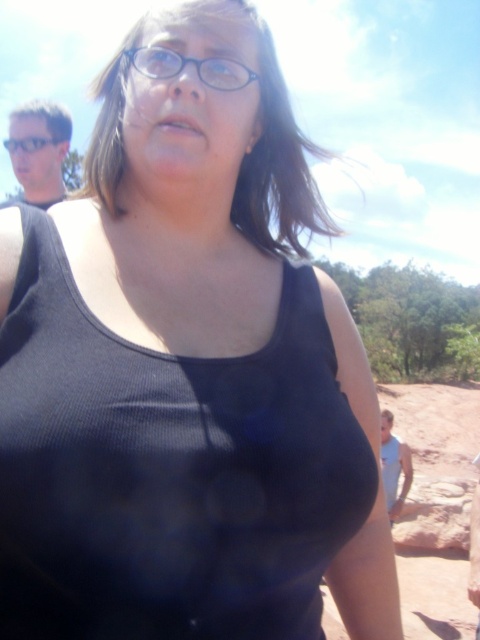
You are a photographer trying to capture the best shot of the two black plastic glasses at center and black plastic glasses at upper center. Which one is smaller in size?

The black plastic glasses at center occupies less space than the black plastic glasses at upper center, so the black plastic glasses at center is smaller in size.

You are a photographer trying to capture the two pairs of black plastic glasses in the scene. Which of the two black plastic glasses at center and black plastic glasses at upper center is located to the right of the other?

The black plastic glasses at center is positioned on the right side of black plastic glasses at upper center.

Looking at this image, you are a photographer setting up a shot of two pairs of black plastic glasses. You have the black plastic glasses at center and the black plastic glasses at upper center. Which pair is wider?

The black plastic glasses at upper center is wider than the black plastic glasses at center.